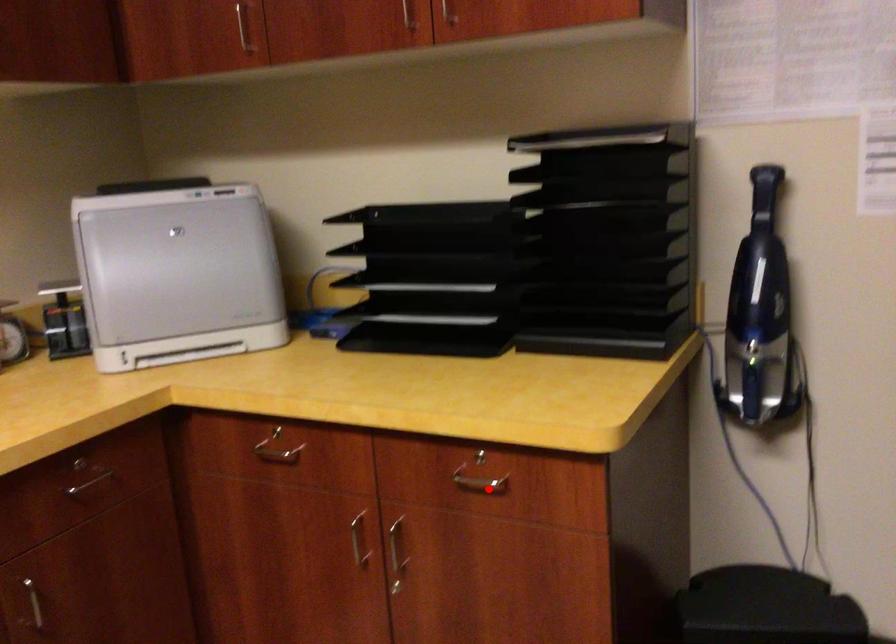
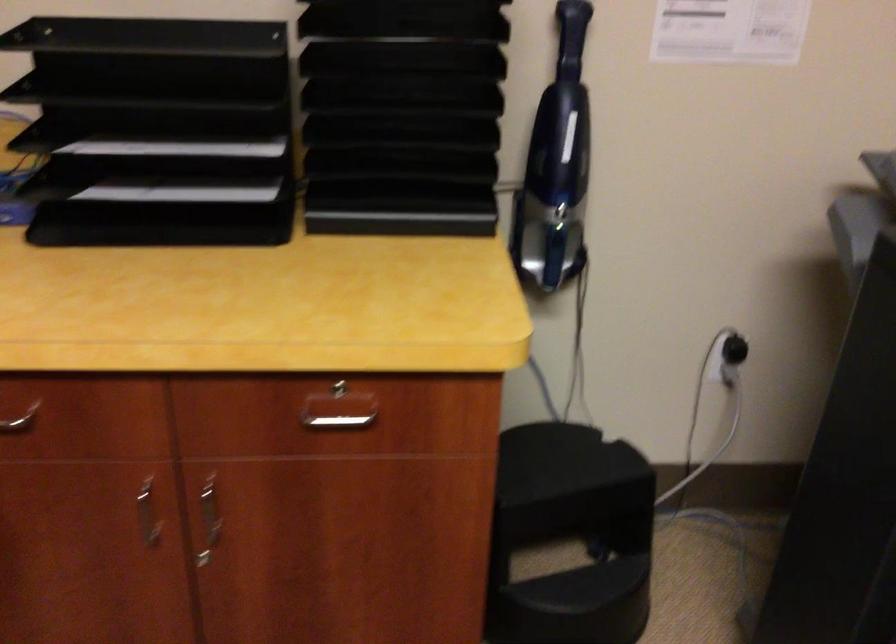
Question: I am providing you with two images of the same scene from different viewpoints. A red point is shown in image1. For the corresponding object point in image2, is it positioned nearer or farther from the camera?

Choices:
 (A) Nearer
 (B) Farther

Answer: (A)